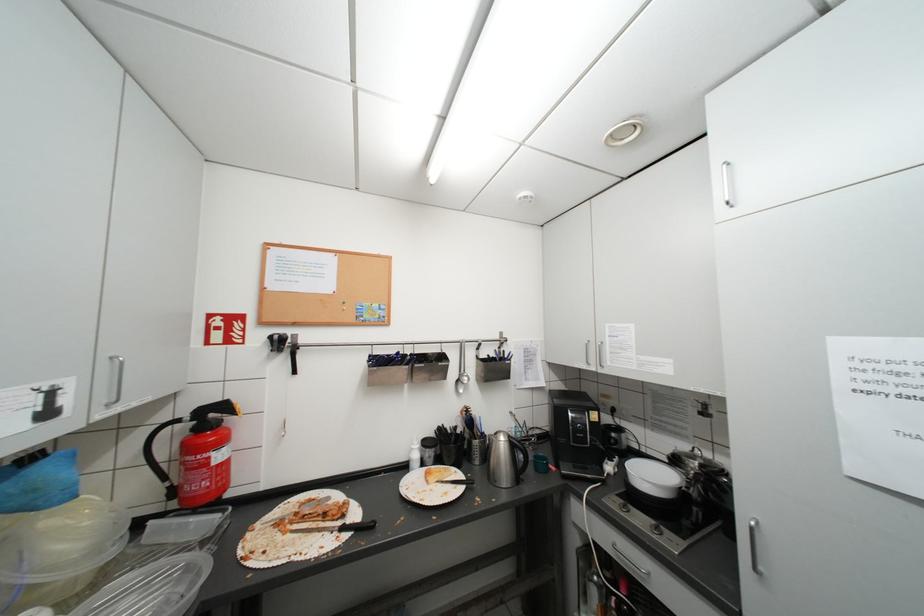
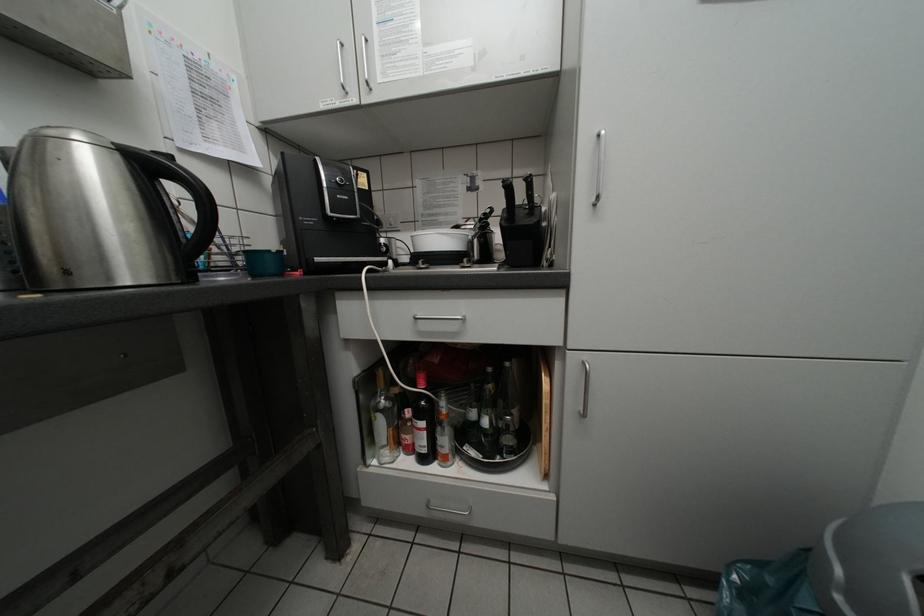
Question: The first image is from the beginning of the video and the second image is from the end. How did the camera likely rotate when shooting the video?

Choices:
 (A) Left
 (B) Right
 (C) Up
 (D) Down

Answer: (B)